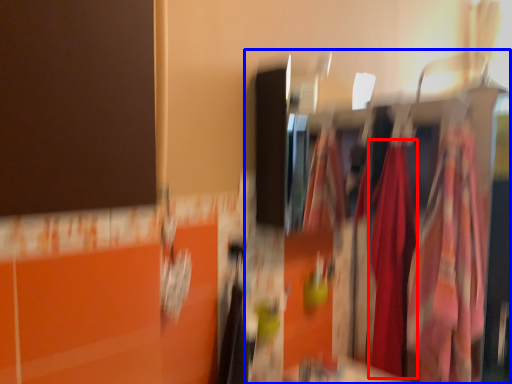
Question: Which object appears farthest to the camera in this image, clothing (highlighted by a red box) or closet (highlighted by a blue box)?

Choices:
 (A) clothing
 (B) closet

Answer: (A)